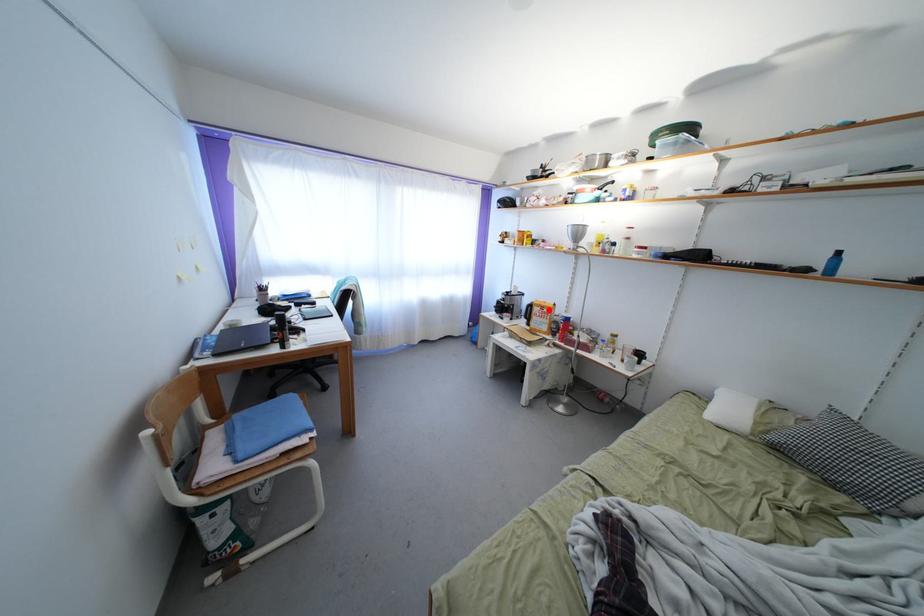
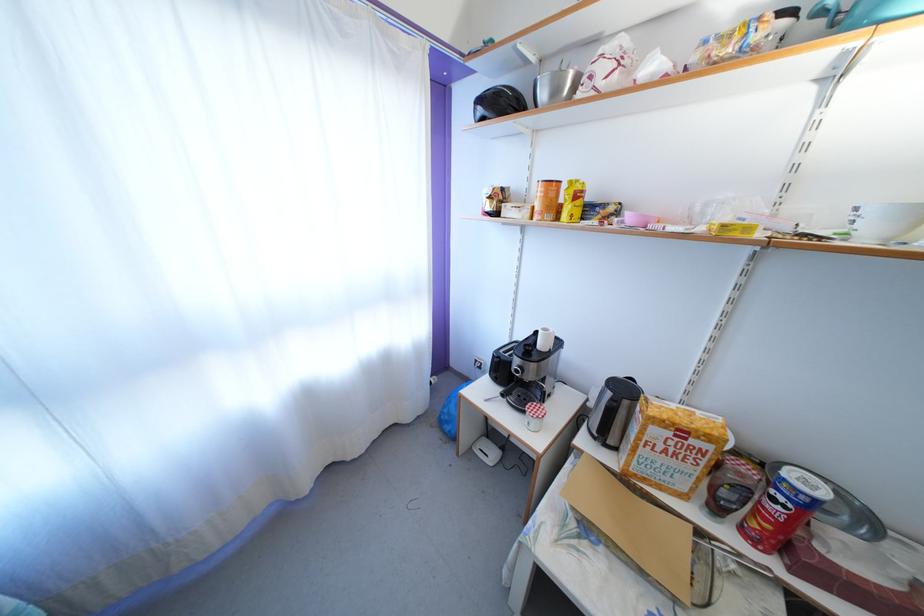
Find the pixel in the second image that matches the highlighted location in the first image.

(688, 428)